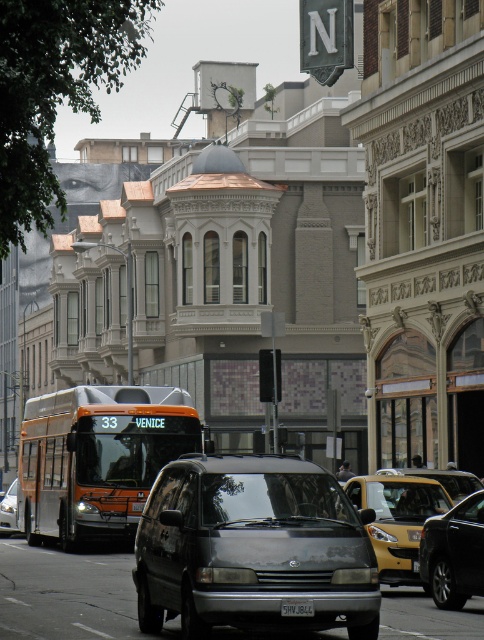
Who is shorter, orange metallic bus at center or shiny black sedan at center?

shiny black sedan at center is shorter.

Who is taller, orange metallic bus at center or shiny black sedan at center?

orange metallic bus at center is taller.

Where is `orange metallic bus at center`? orange metallic bus at center is located at coordinates (99, 456).

Is shiny black sedan at center bigger than metallic silver van at center?

No, shiny black sedan at center is not bigger than metallic silver van at center.

Who is more distant from viewer, (468, 545) or (11, 500)?

The point (11, 500) is behind.

In order to click on shiny black sedan at center in this screenshot , I will do `click(453, 554)`.

Is point (106, 451) in front of point (13, 525)?

That is True.

Between point (119, 525) and point (2, 534), which one is positioned in front?

Positioned in front is point (119, 525).

I want to click on orange metallic bus at center, so click(x=99, y=456).